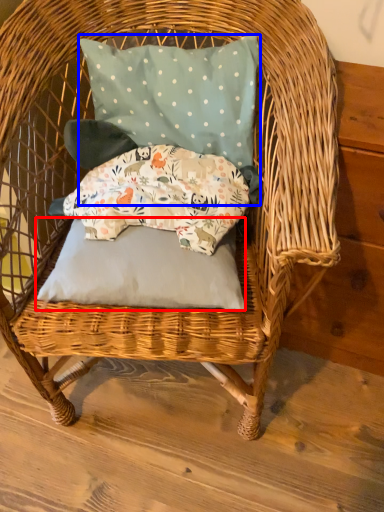
Question: Which of the following is the closest to the observer, pillow (highlighted by a red box) or pillow (highlighted by a blue box)?

Choices:
 (A) pillow
 (B) pillow

Answer: (A)